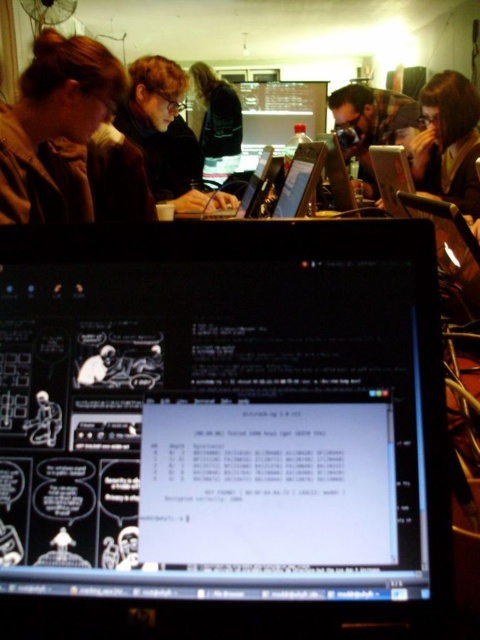
You are a photographer trying to capture a clear shot of the matte black laptop at center without including the brown fuzzy jacket at upper left in the frame. Based on their positions, is this possible?

The brown fuzzy jacket at upper left is located below the matte black laptop at center, so it is possible to capture the matte black laptop at center without including the brown fuzzy jacket at upper left by adjusting the camera angle upwards to exclude the jacket below.

From the picture: You are a photographer wanting to capture a clear shot of the matte black laptop at center without the brown fuzzy jacket at upper left blocking it. What should you do?

Move the camera closer to the matte black laptop at center so that it moves in front of the brown fuzzy jacket at upper left, since the brown fuzzy jacket at upper left is closer to the viewer than the laptop.